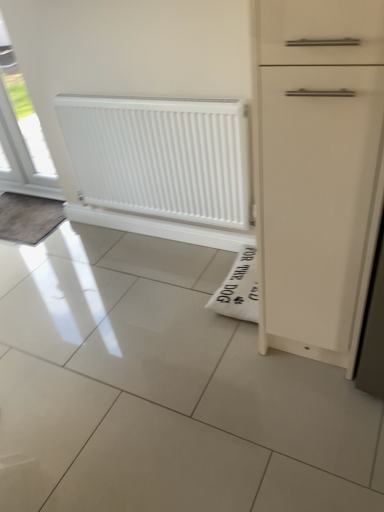
Question: Is white glossy window at upper left inside the boundaries of dark gray textured mat at left, or outside?

Choices:
 (A) outside
 (B) inside

Answer: (A)

Question: Considering their positions, is white glossy window at upper left located in front of or behind dark gray textured mat at left?

Choices:
 (A) behind
 (B) front

Answer: (B)

Question: Estimate the real-world distances between objects in this image. Which object is closer to the dark gray textured mat at left?

Choices:
 (A) white glossy window at upper left
 (B) white smooth radiator at center

Answer: (B)

Question: Which is nearer to the white glossy window at upper left?

Choices:
 (A) dark gray textured mat at left
 (B) white smooth radiator at center

Answer: (A)